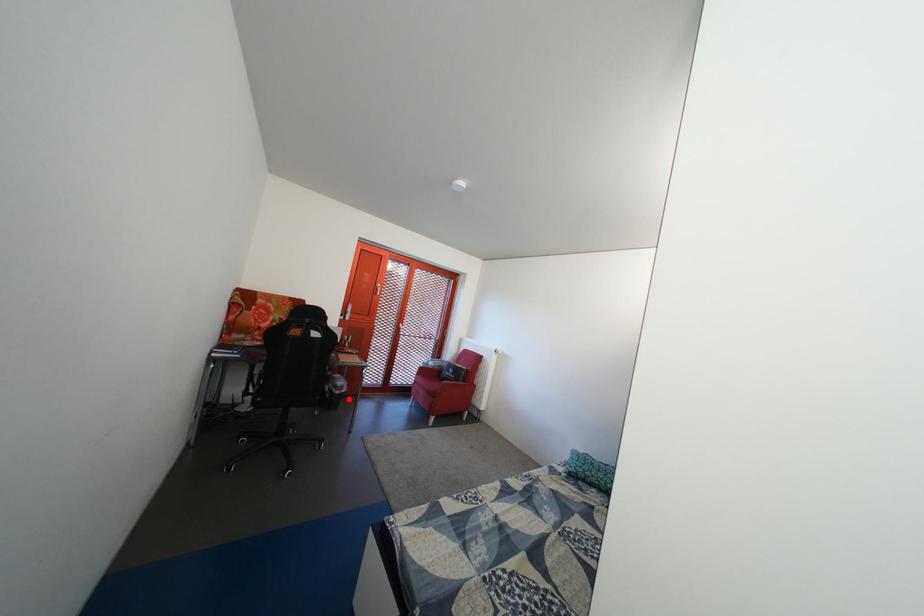
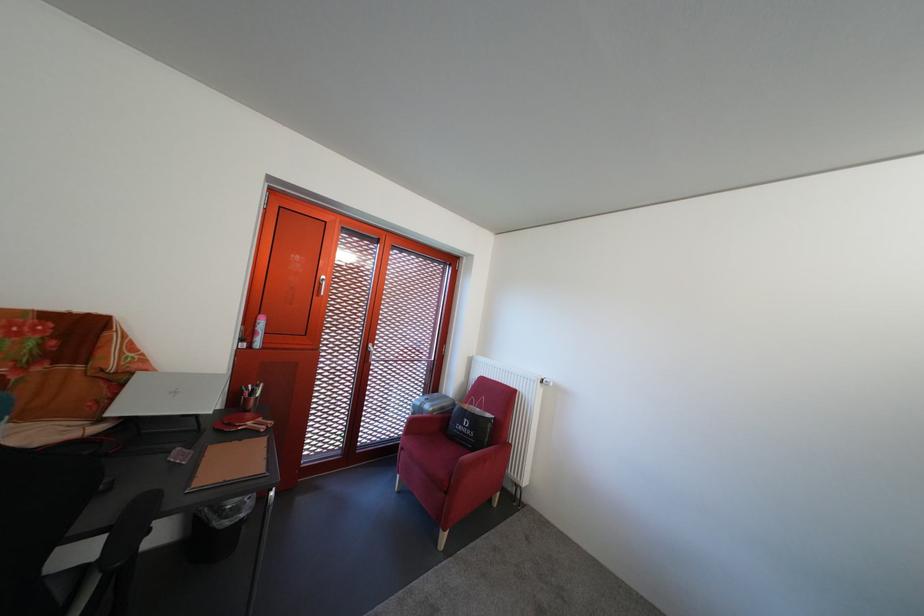
Where in the second image is the point corresponding to the highlighted location from the first image?

(237, 530)